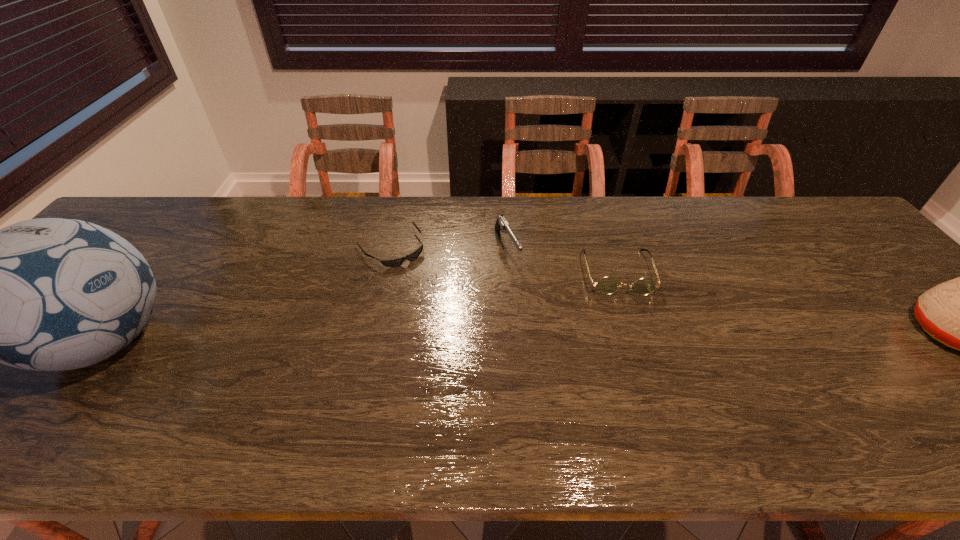
Where is `sunglasses`? This screenshot has width=960, height=540. sunglasses is located at coordinates (395, 262).

I want to click on the shortest object, so click(x=395, y=262).

The image size is (960, 540). Find the location of `the second object from right to left`. the second object from right to left is located at coordinates (607, 285).

Find the location of a particular element. This screenshot has height=540, width=960. the second shortest object is located at coordinates (607, 285).

Locate an element on the screen. the third shortest object is located at coordinates [x=501, y=224].

Find the location of `the third object from right to left`. the third object from right to left is located at coordinates (501, 224).

Image resolution: width=960 pixels, height=540 pixels. Find the location of `vacant region located on the front-facing side of the fourth object from right to left`. vacant region located on the front-facing side of the fourth object from right to left is located at coordinates (418, 281).

Where is `vacant point located on the front-facing side of the fourth object from right to left`? The width and height of the screenshot is (960, 540). vacant point located on the front-facing side of the fourth object from right to left is located at coordinates (475, 356).

Where is `vacant region located on the front-facing side of the fourth object from right to left`? The width and height of the screenshot is (960, 540). vacant region located on the front-facing side of the fourth object from right to left is located at coordinates (416, 278).

Locate an element on the screen. This screenshot has height=540, width=960. blank space located 0.080m on the lenses of the fourth object from left to right is located at coordinates (630, 320).